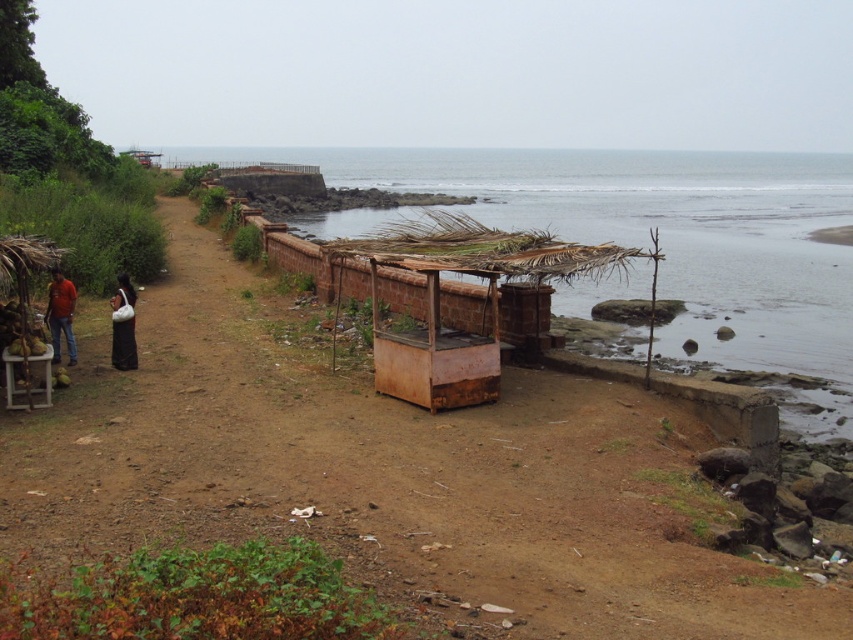
You are a traveler carrying a large backpack and want to set it down on the ground near the rusty wood stall at center and the dark brown fabric dress at left. Which object should you place your backpack next to if you want it closer to the sea?

The rusty wood stall at center is closer to the sea than the dark brown fabric dress at left, so place the backpack next to the rusty wood stall at center.

You are a photographer wanting to capture both the matte red shirt at left and the dark brown fabric dress at left in a single frame. Since you want both subjects to be clearly visible, which clothing item should you focus on first to ensure it appears in focus?

The matte red shirt at left is larger in size compared to the dark brown fabric dress at left, so focusing on the matte red shirt at left first will ensure it appears in focus while the smaller dark brown fabric dress at left may still be in the depth of field.

You are a tourist visiting the coastal area and notice a matte red shirt at left. Based on the coordinates provided, where exactly would you look to find it?

The matte red shirt at left is located at the coordinates point (61,314).